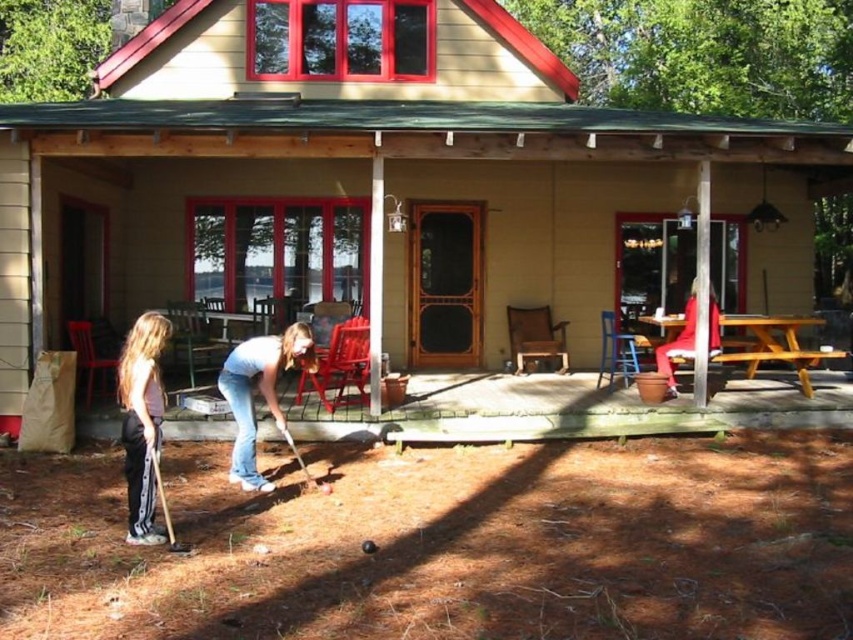
Does point (579, 385) lie behind point (712, 296)?

No, it is not.

Between wooden picnic table at center and red fabric chair at right, which one is positioned lower?

Positioned lower is wooden picnic table at center.

You are a GUI agent. You are given a task and a screenshot of the screen. Output one action in this format:
    pyautogui.click(x=<x>, y=<y>)
    Task: Click on the wooden picnic table at center
    This screenshot has height=640, width=853.
    Given the screenshot: What is the action you would take?
    pyautogui.click(x=573, y=410)

At what (x,y) coordinates should I click in order to perform the action: click on wooden picnic table at center. Please return your answer as a coordinate pair (x, y). Looking at the image, I should click on (573, 410).

Is light pink cotton shirt at left positioned before blue jeans at center?

Yes, it is.

Consider the image. Does light pink cotton shirt at left have a smaller size compared to blue jeans at center?

Yes.

Is point (149, 520) farther from viewer compared to point (279, 424)?

No, (149, 520) is closer to viewer.

Image resolution: width=853 pixels, height=640 pixels. Find the location of `light pink cotton shirt at left`. light pink cotton shirt at left is located at coordinates (141, 420).

Between point (144, 538) and point (708, 342), which one is positioned behind?

Point (708, 342)

Can you confirm if light pink cotton shirt at left is shorter than red fabric chair at right?

No, light pink cotton shirt at left is not shorter than red fabric chair at right.

The height and width of the screenshot is (640, 853). I want to click on light pink cotton shirt at left, so click(141, 420).